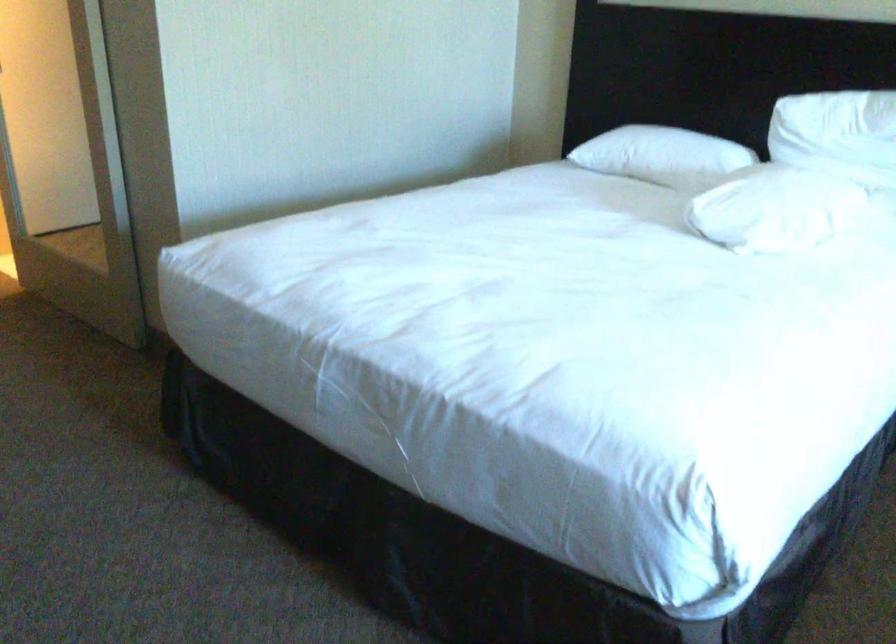
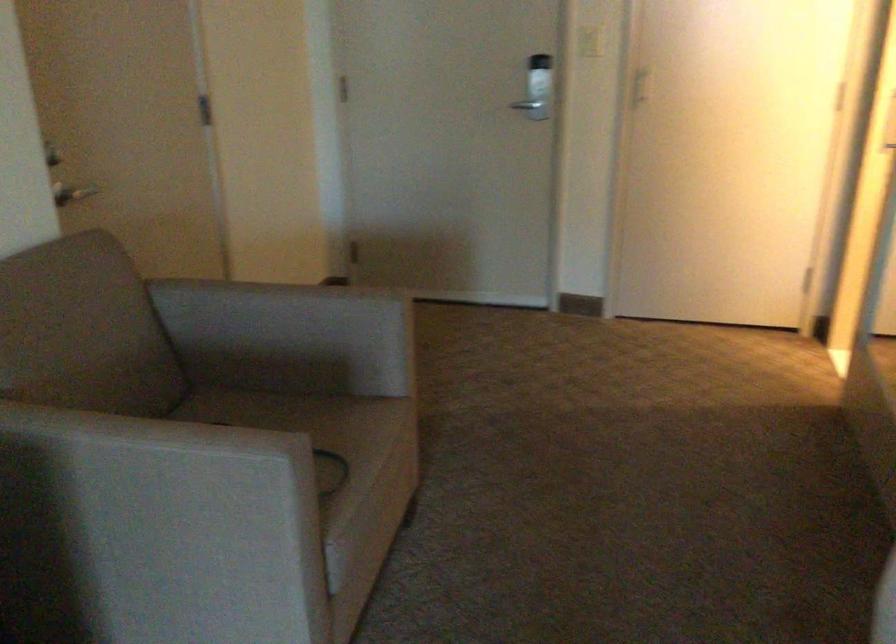
Question: The images are taken continuously from a first-person perspective. In which direction is your viewpoint rotating?

Choices:
 (A) Left
 (B) Right
 (C) Up
 (D) Down

Answer: (A)